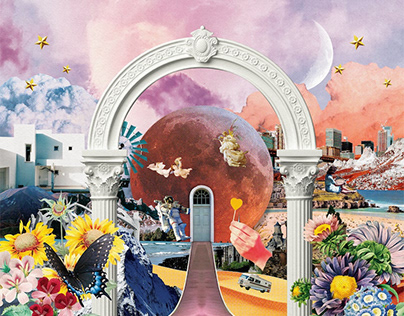
You are a GUI agent. You are given a task and a screenshot of the screen. Output one action in this format:
    pyautogui.click(x=<x>, y=<y>)
    Task: Click on the white arch
    This screenshot has width=404, height=316.
    Given the screenshot: What is the action you would take?
    pyautogui.click(x=243, y=70), pyautogui.click(x=181, y=65)